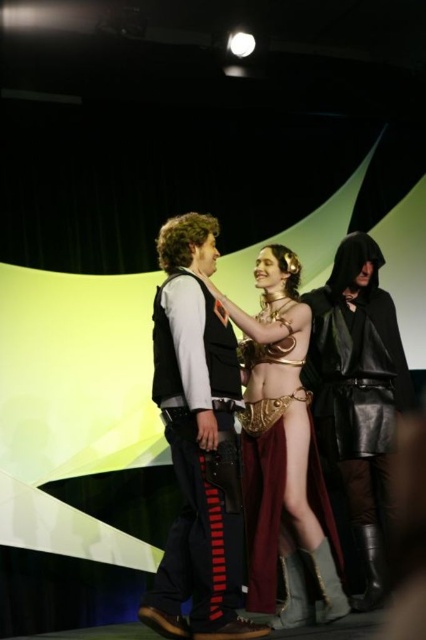
Question: Can you confirm if velvet black vest at center is bigger than gold metallic armor at center?

Choices:
 (A) yes
 (B) no

Answer: (B)

Question: Which object is the closest to the gold metallic armor at center?

Choices:
 (A) velvet black vest at center
 (B) black leather cloak at right

Answer: (B)

Question: In this image, where is velvet black vest at center located relative to black leather cloak at right?

Choices:
 (A) right
 (B) left

Answer: (B)

Question: Which object is positioned farthest from the gold metallic armor at center?

Choices:
 (A) velvet black vest at center
 (B) black leather cloak at right

Answer: (A)

Question: Can you confirm if gold metallic armor at center is wider than black leather cloak at right?

Choices:
 (A) no
 (B) yes

Answer: (B)

Question: Which of the following is the farthest from the observer?

Choices:
 (A) velvet black vest at center
 (B) gold metallic armor at center

Answer: (B)